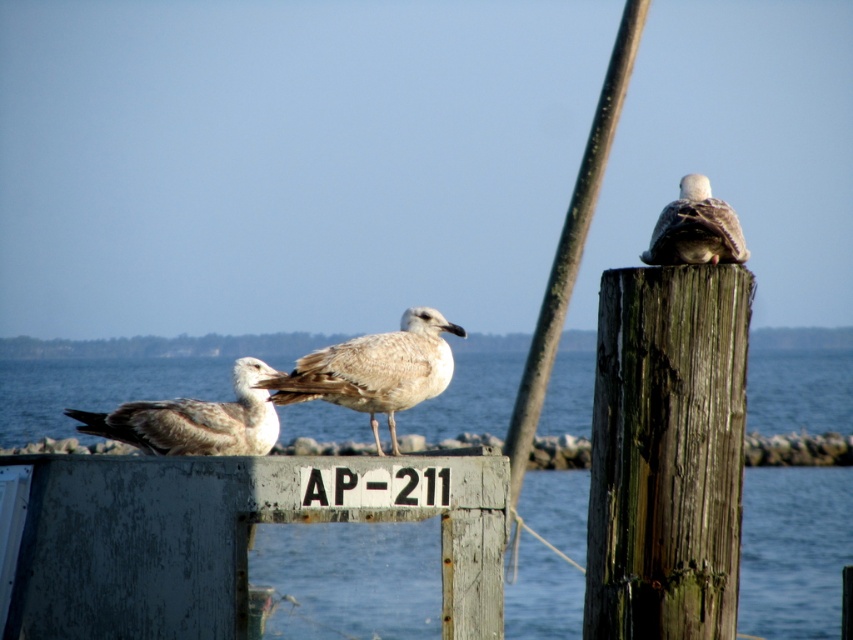
Who is lower down, light brown feathered seagull at center or white feathered bird at upper right?

light brown feathered seagull at center

Is light brown feathered seagull at center positioned behind white feathered bird at upper right?

Yes, light brown feathered seagull at center is further from the viewer.

Where is `light brown feathered seagull at center`? Image resolution: width=853 pixels, height=640 pixels. light brown feathered seagull at center is located at coordinates (375, 371).

This screenshot has height=640, width=853. I want to click on light brown feathered seagull at center, so click(x=375, y=371).

Does blue water at center have a lesser width compared to light brown feathered seagull at left?

No, blue water at center is not thinner than light brown feathered seagull at left.

What do you see at coordinates (351, 579) in the screenshot? I see `blue water at center` at bounding box center [351, 579].

Identify the location of blue water at center. The image size is (853, 640). (351, 579).

Which is above, blue water at center or weathered wood post at upper right?

weathered wood post at upper right

Based on the photo, can you confirm if blue water at center is positioned to the right of weathered wood post at upper right?

In fact, blue water at center is to the left of weathered wood post at upper right.

This screenshot has height=640, width=853. What do you see at coordinates (351, 579) in the screenshot?
I see `blue water at center` at bounding box center [351, 579].

At what (x,y) coordinates should I click in order to perform the action: click on blue water at center. Please return your answer as a coordinate pair (x, y). The height and width of the screenshot is (640, 853). Looking at the image, I should click on (351, 579).